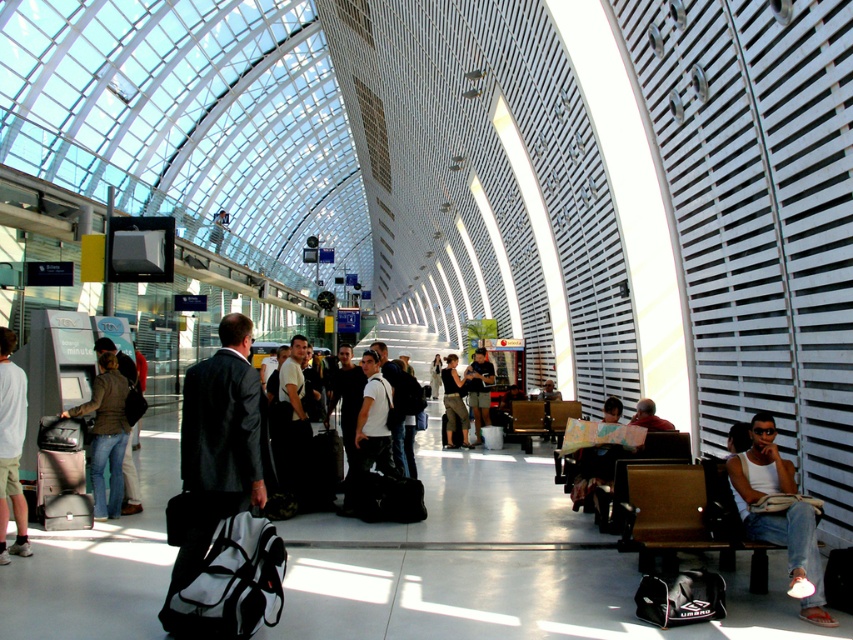
Which is behind, point (96, 452) or point (463, 442)?

Positioned behind is point (463, 442).

Based on the photo, can you confirm if denim jacket at left is smaller than dark gray fabric jacket at center?

Correct, denim jacket at left occupies less space than dark gray fabric jacket at center.

Is point (123, 403) behind point (462, 444)?

No, (123, 403) is closer to viewer.

Identify the location of denim jacket at left. (106, 435).

Is matte black suitcase at lower left shorter than denim jacket at left?

Yes.

Which of these two, matte black suitcase at lower left or denim jacket at left, stands shorter?

matte black suitcase at lower left is shorter.

Locate an element on the screen. Image resolution: width=853 pixels, height=640 pixels. matte black suitcase at lower left is located at coordinates (62, 474).

Which of these two, denim jacket at left or dark gray suit at center, stands shorter?

Standing shorter between the two is denim jacket at left.

Locate an element on the screen. denim jacket at left is located at coordinates (106, 435).

Does point (94, 403) lie behind point (479, 424)?

No, (94, 403) is in front of (479, 424).

At what (x,y) coordinates should I click in order to perform the action: click on denim jacket at left. Please return your answer as a coordinate pair (x, y). This screenshot has width=853, height=640. Looking at the image, I should click on (106, 435).